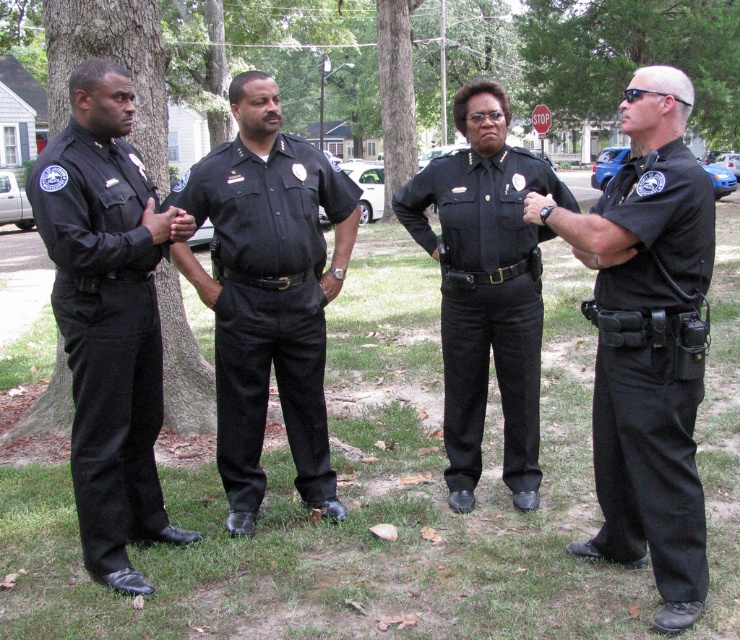
Can you confirm if green bark tree at center is smaller than green textured tree at center?

No, green bark tree at center is not smaller than green textured tree at center.

Is green bark tree at center to the left of green textured tree at center from the viewer's perspective?

Incorrect, green bark tree at center is not on the left side of green textured tree at center.

Does point (582, 88) lie behind point (408, 93)?

Yes, it is.

Where is `green bark tree at center`? The height and width of the screenshot is (640, 740). green bark tree at center is located at coordinates (618, 56).

Which is more to the right, green bark tree at center or brown textured tree trunk at left?

Positioned to the right is green bark tree at center.

Between point (571, 115) and point (117, 52), which one is positioned behind?

Point (571, 115)

Find the location of a particular element. The height and width of the screenshot is (640, 740). green bark tree at center is located at coordinates (618, 56).

Measure the distance from matte black uniform at left to brown textured tree trunk at left.

matte black uniform at left and brown textured tree trunk at left are 6.65 feet apart from each other.

Is point (154, 488) farther from camera compared to point (56, 48)?

No, (154, 488) is in front of (56, 48).

Locate an element on the screen. The width and height of the screenshot is (740, 640). matte black uniform at left is located at coordinates (104, 333).